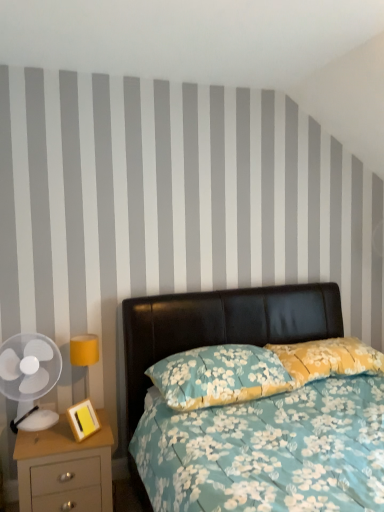
Find the location of a particular element. vacant area on top of beige wood nightstand at lower left (from a real-world perspective) is located at coordinates (57, 428).